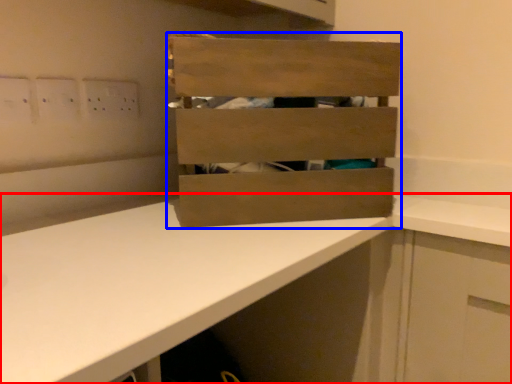
Question: Which point is further to the camera, countertop (highlighted by a red box) or crate (highlighted by a blue box)?

Choices:
 (A) countertop
 (B) crate

Answer: (B)